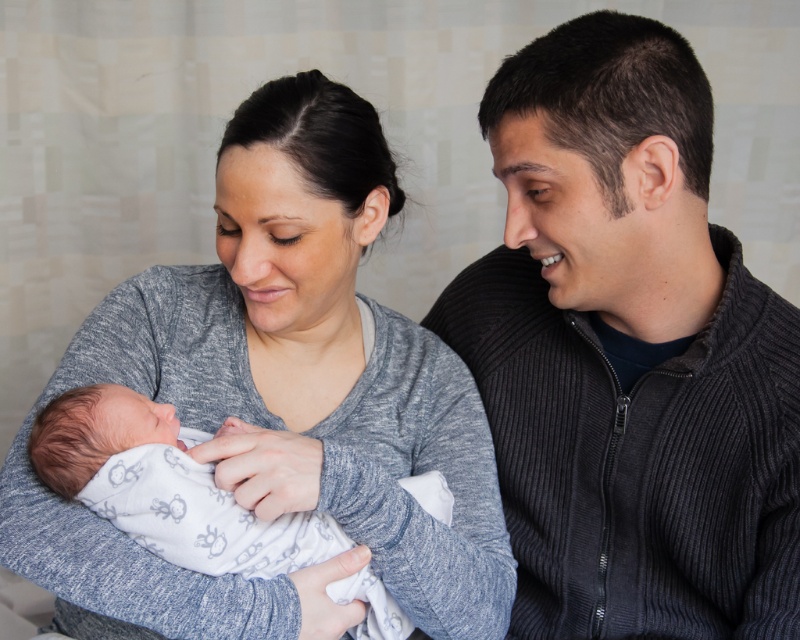
Question: Can you confirm if gray soft fabric baby at center is positioned below white soft fabric newborn at center?

Choices:
 (A) yes
 (B) no

Answer: (B)

Question: Which of the following is the farthest from the observer?

Choices:
 (A) (378, 372)
 (B) (505, 445)
 (C) (216, 547)

Answer: (B)

Question: Which of the following is the farthest from the observer?

Choices:
 (A) (304, 200)
 (B) (176, 445)

Answer: (A)

Question: Can you confirm if gray soft fabric baby at center is positioned above white soft fabric newborn at center?

Choices:
 (A) yes
 (B) no

Answer: (A)

Question: Which of the following is the farthest from the observer?

Choices:
 (A) (609, 108)
 (B) (342, 556)

Answer: (B)

Question: Can you confirm if gray soft fabric baby at center is wider than white soft fabric newborn at center?

Choices:
 (A) no
 (B) yes

Answer: (B)